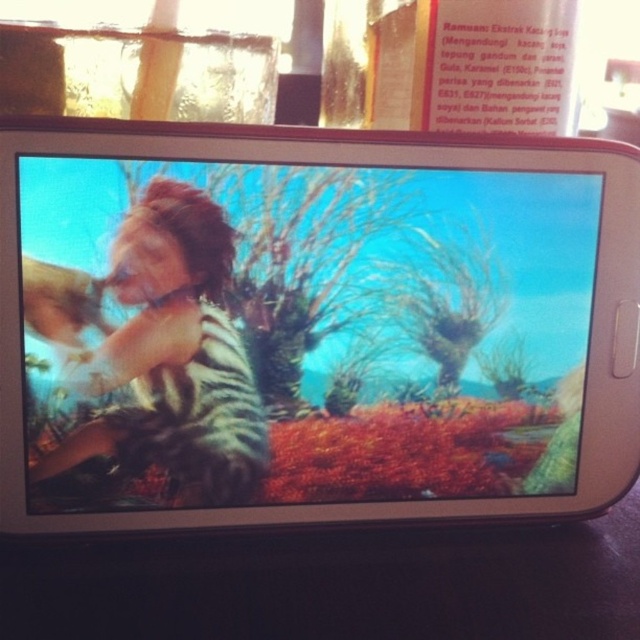
Question: Is the position of matte plastic screen at center less distant than that of shiny metallic phone at center?

Choices:
 (A) no
 (B) yes

Answer: (B)

Question: Is matte plastic screen at center in front of shiny metallic phone at center?

Choices:
 (A) no
 (B) yes

Answer: (B)

Question: Which point is farther to the camera?

Choices:
 (A) shiny metallic phone at center
 (B) matte plastic screen at center

Answer: (A)

Question: Which object is farther from the camera taking this photo?

Choices:
 (A) matte plastic screen at center
 (B) shiny metallic phone at center

Answer: (B)

Question: Is matte plastic screen at center below shiny metallic phone at center?

Choices:
 (A) yes
 (B) no

Answer: (B)